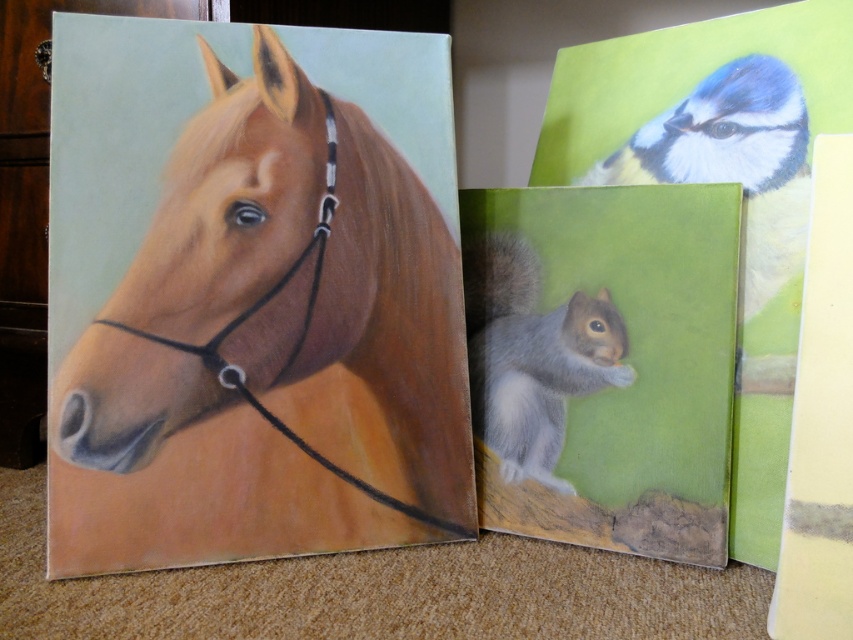
Question: From the image, what is the correct spatial relationship of blue glossy bird at upper right in relation to satin black bridle at left?

Choices:
 (A) left
 (B) right

Answer: (B)

Question: Based on their relative distances, which object is nearer to the matte brown horse at left?

Choices:
 (A) gray furry squirrel at center
 (B) satin black bridle at left
 (C) blue glossy bird at upper right

Answer: (B)

Question: Which point is closer to the camera?

Choices:
 (A) satin black bridle at left
 (B) gray furry squirrel at center
 (C) matte brown horse at left

Answer: (C)

Question: Which object appears closest to the camera in this image?

Choices:
 (A) gray furry squirrel at center
 (B) blue glossy bird at upper right

Answer: (B)

Question: Is matte brown horse at left wider than gray furry squirrel at center?

Choices:
 (A) no
 (B) yes

Answer: (B)

Question: Is matte brown horse at left further to the viewer compared to blue glossy bird at upper right?

Choices:
 (A) no
 (B) yes

Answer: (A)